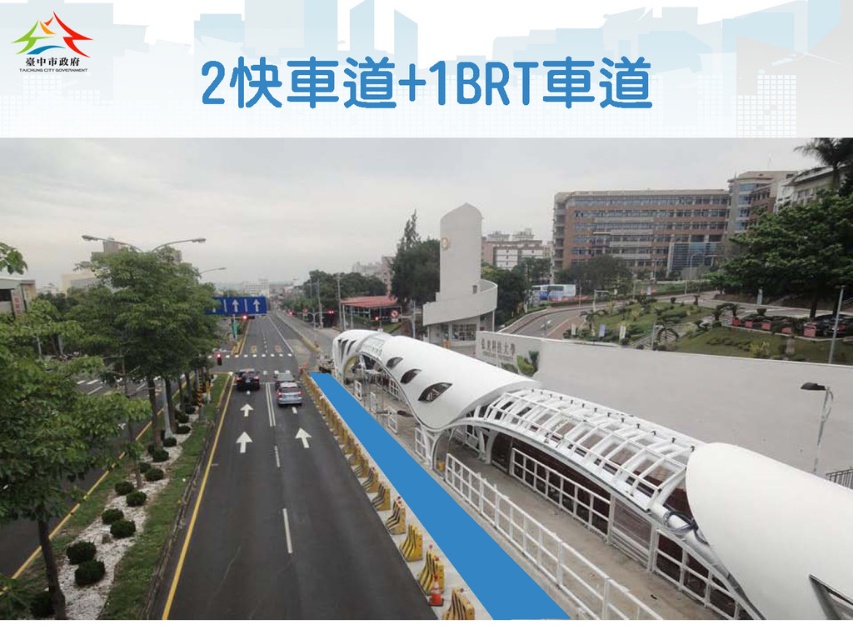
You are a city planner designing a new BRT lane. You need to ensure that both the matte silver car at center and the shiny black car at center can fit in the BRT lane. Given that the BRT lane has a standard width of 3.5 meters, can both vehicles safely pass each other within the lane?

The matte silver car at center is wider than the shiny black car at center. Since the BRT lane is only 3.5 meters wide, and the combined width of both vehicles would exceed this measurement, they cannot safely pass each other within the lane.

You are driving a matte silver car at center and want to turn left onto a side street located to the left of the black asphalt highway at center. Can you make this turn from your current position?

The black asphalt highway at center is to the right of the matte silver car at center, so the side street to the left of the black asphalt highway at center would be to the left of the highway, which is not directly accessible from the car. The car is positioned to the left of the highway, so turning left might require moving into the correct lane or finding an appropriate turn signal. However, based on the spatial arrangement provided, the turn might not be possible from the current position without first.

You are a pedestrian standing at the edge of the black asphalt highway at center and the matte silver car at center. Which object is higher from the ground?

The black asphalt highway at center is much taller than the matte silver car at center, so the black asphalt highway at center is higher from the ground.